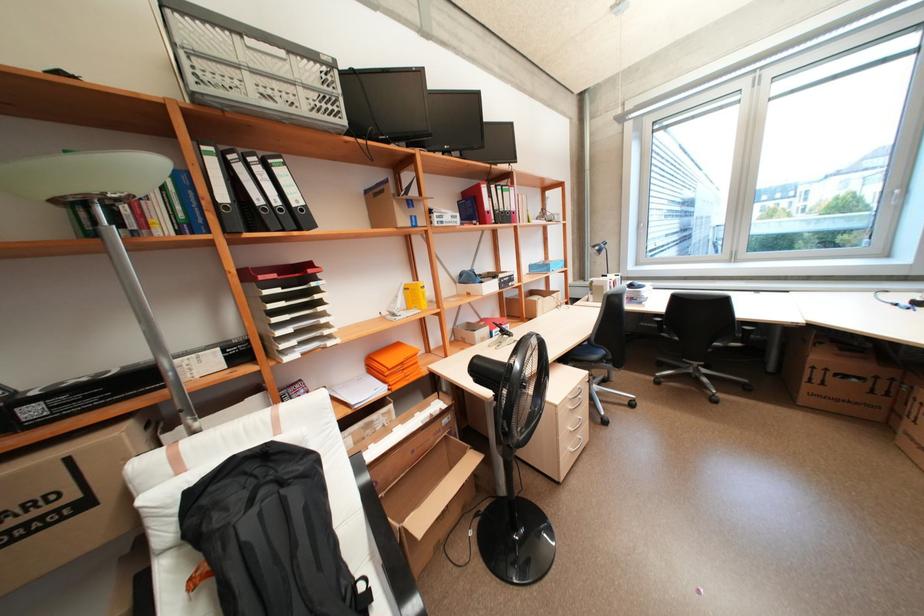
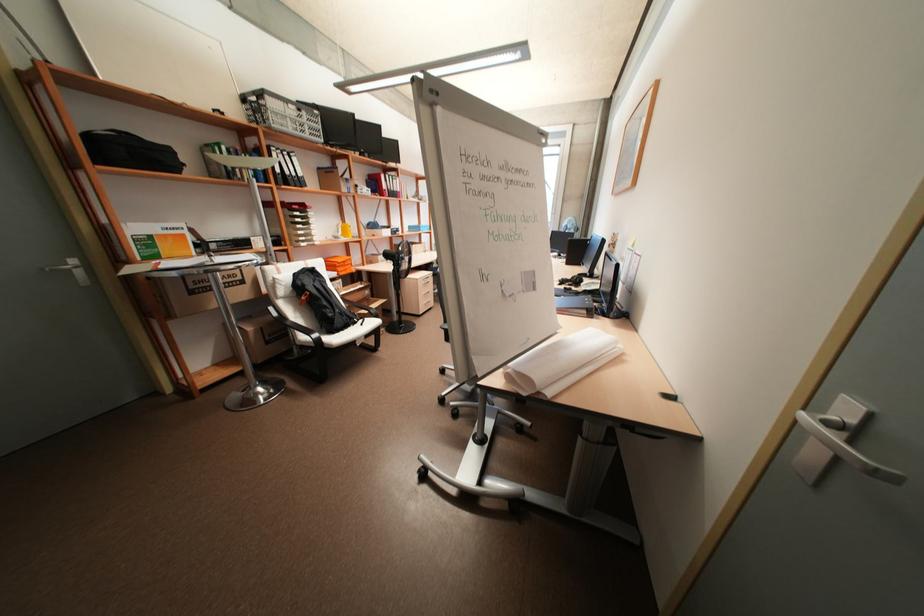
Where in the second image is the point corresponding to point (257, 501) from the first image?

(320, 281)